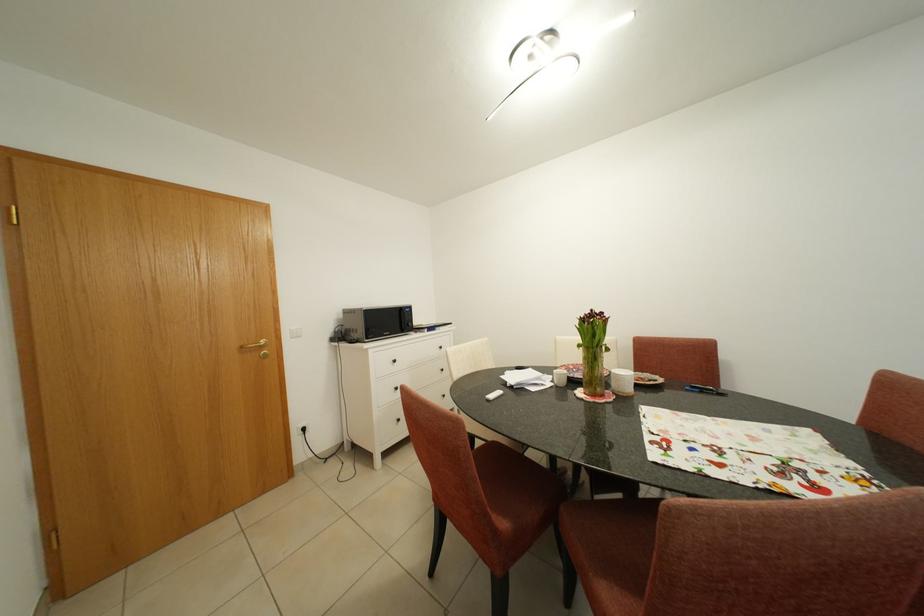
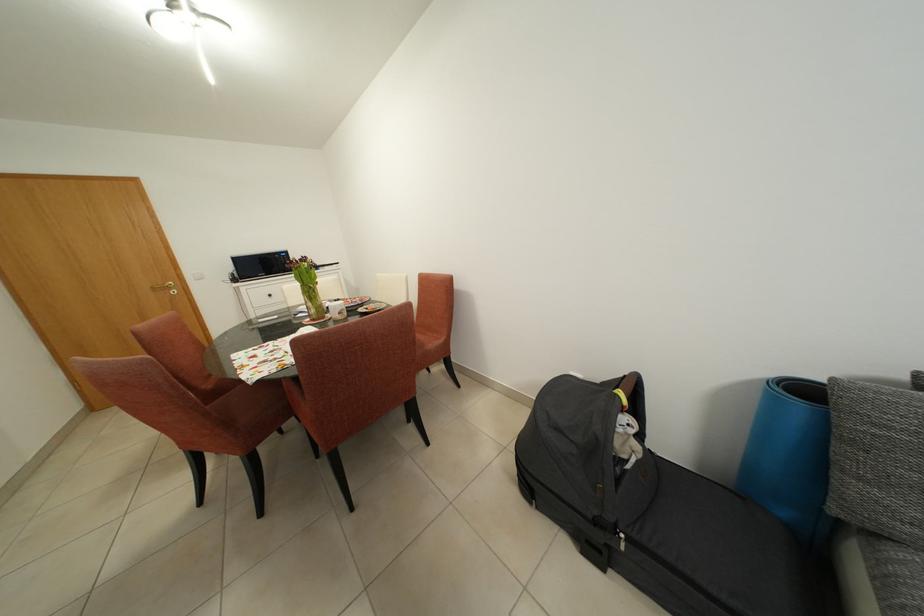
Question: In a continuous first-person perspective shot, in which direction is the camera moving?

Choices:
 (A) Left
 (B) Right
 (C) Forward
 (D) Backward

Answer: (B)